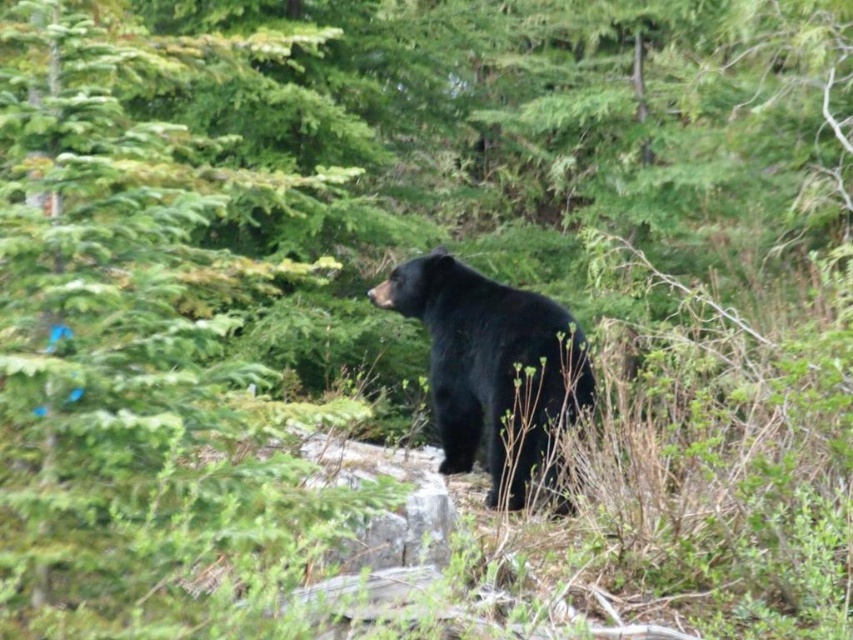
Is point (247, 545) positioned before point (427, 280)?

Yes, it is.

Between green leafy tree at center and black furry bear at center, which one appears on the right side from the viewer's perspective?

Positioned to the right is black furry bear at center.

What are the coordinates of `green leafy tree at center` in the screenshot? It's located at (131, 362).